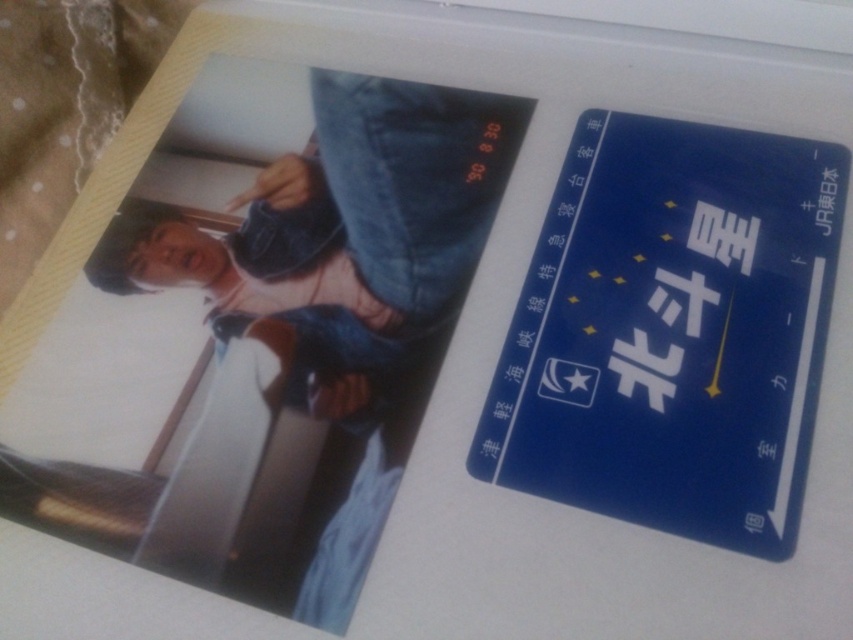
You are designing a layout for a promotional poster and need to place a new element at coordinates 0.5, 0.8. Is there enough space between the blue card at upper right and the edge of the poster to add this new element without overlapping?

The blue card at upper right is positioned at point (672, 330). The new element at (682, 320) is very close but slightly to the left and above the blue card. Since the exact dimensions of the new element are not provided, it is uncertain if there will be an overlap. However, the proximity suggests careful placement is needed to avoid overlapping.

You are holding a 1.0 meter long measuring tape and want to measure the distance from the camera to the point at coordinates point (569, 371). Can you reach the point with your measuring tape?

The point (569, 371) is 1.10 meters from the camera. Since the measuring tape is only 1.0 meters long, it is not long enough to reach the point. You would need a longer measuring tape or another tool to measure this distance.

You are designing a layout for a promotional poster and need to ensure proper alignment between the blue card at upper right and the denim jacket at upper center. Which object should be placed closer to the right edge of the poster?

The blue card at upper right should be placed closer to the right edge of the poster because it is positioned to the right of the denim jacket at upper center.